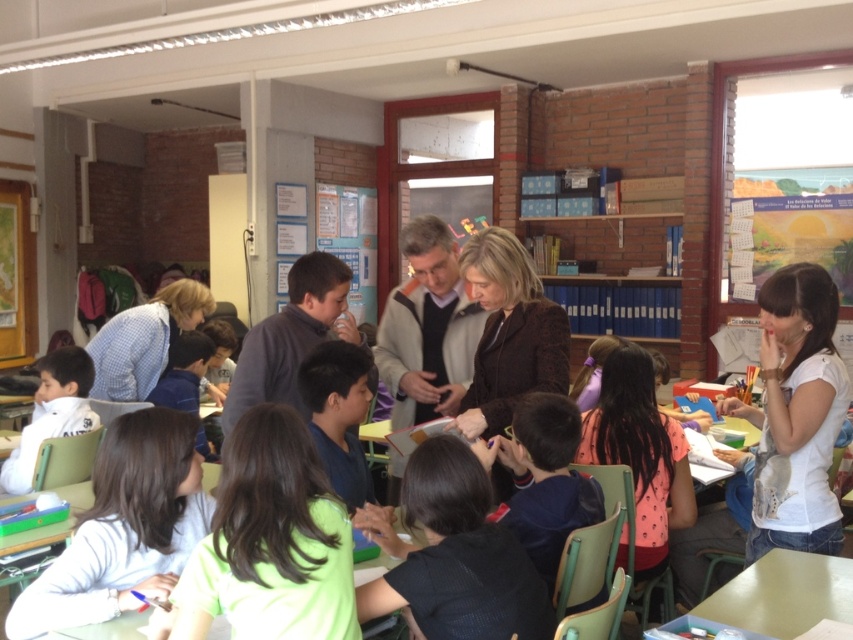
Question: Does dark green shirt at center appear under green matte table at lower right?

Choices:
 (A) no
 (B) yes

Answer: (A)

Question: Does light blue shirt at lower left appear on the left side of green matte table at lower right?

Choices:
 (A) yes
 (B) no

Answer: (A)

Question: Estimate the real-world distances between objects in this image. Which object is farther from the light blue shirt at lower left?

Choices:
 (A) dark brown sweater at center
 (B) white cotton shirt at right
 (C) green matte table at lower right

Answer: (B)

Question: Considering the real-world distances, which object is closest to the white cotton shirt at right?

Choices:
 (A) light blue shirt at lower left
 (B) dark green shirt at center
 (C) green matte table at lower right
 (D) dark blue sweater at center

Answer: (C)

Question: Which object appears farthest from the camera in this image?

Choices:
 (A) green fabric shirt at center
 (B) dark green shirt at center

Answer: (B)

Question: Does dark brown sweater at center have a lesser width compared to green matte table at lower right?

Choices:
 (A) no
 (B) yes

Answer: (A)